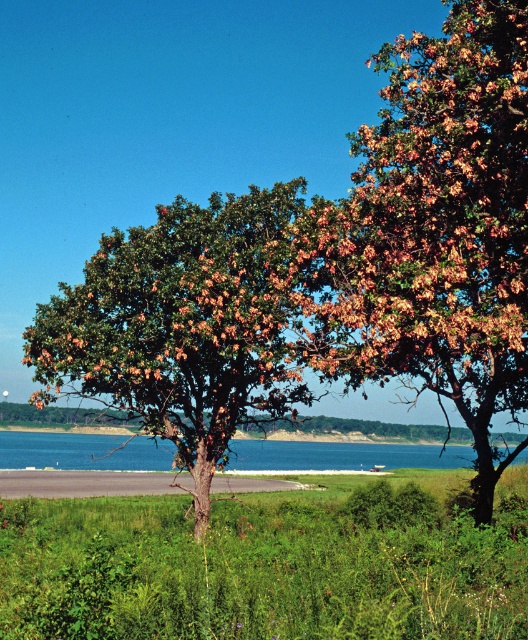
You are standing on the gray asphalt at lower center and want to reach the blue liquid water at center. Based on the scene description, which direction should you move to get closer to the water?

The blue liquid water at center is taller than gray asphalt at lower center, so you should move upward to get closer to the blue liquid water at center.